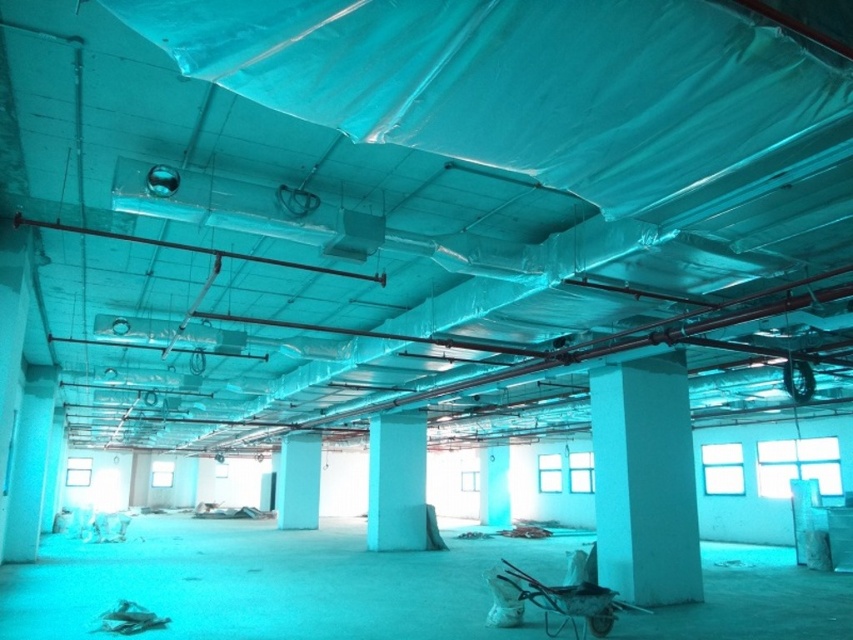
Looking at this image, you are standing in the construction area and need to locate the smooth concrete pillar at center and the white smooth pillar at center. According to their positions, which one is more to the left?

The white smooth pillar at center is more to the left since the smooth concrete pillar at center is to the right of it.